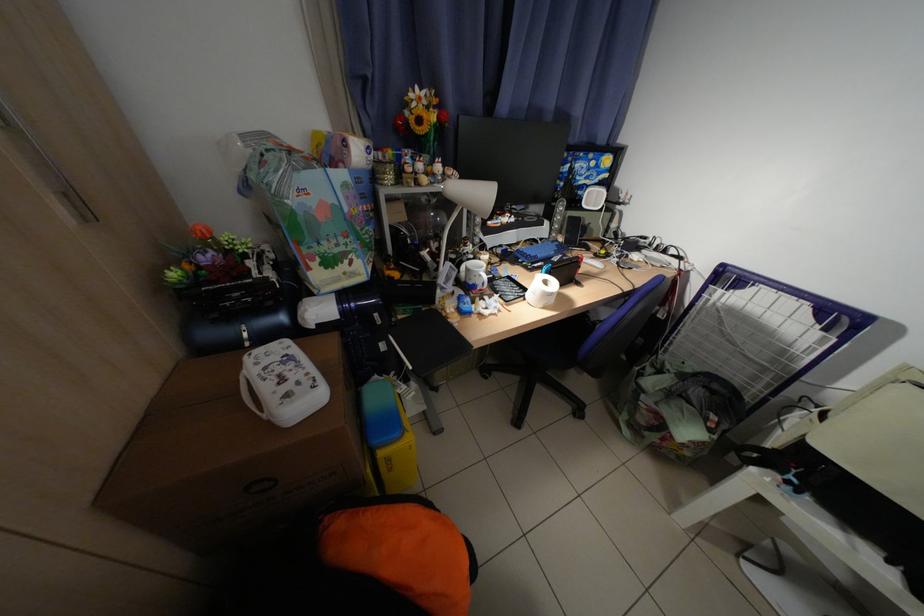
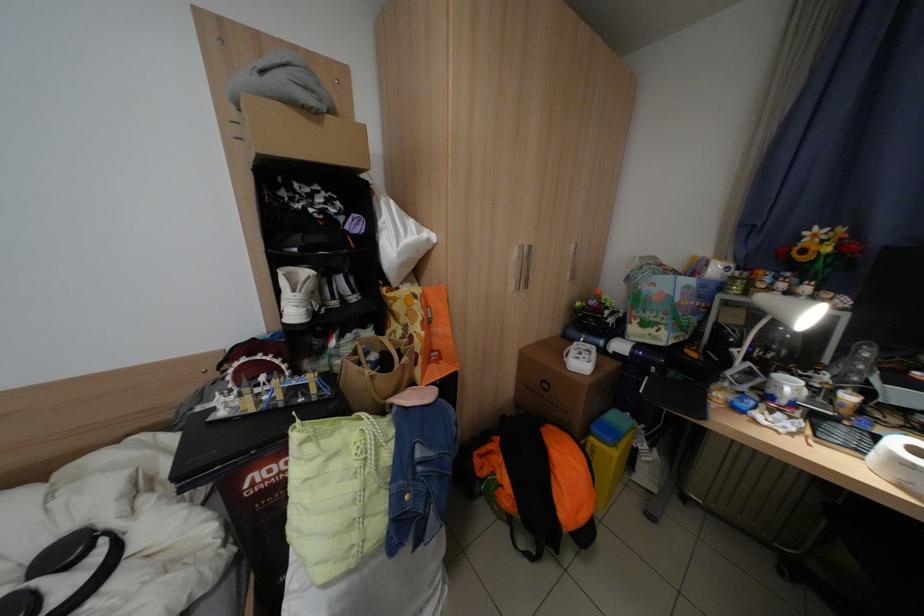
The point at (456,269) is marked in the first image. Where is the corresponding point in the second image?

(752, 366)